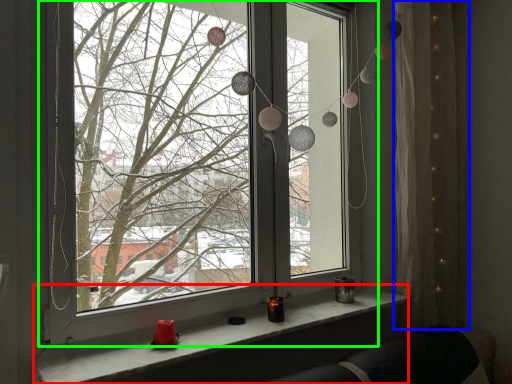
Question: Which is nearer to the window sill (highlighted by a red box)? curtain (highlighted by a blue box) or window (highlighted by a green box).

Choices:
 (A) curtain
 (B) window

Answer: (A)